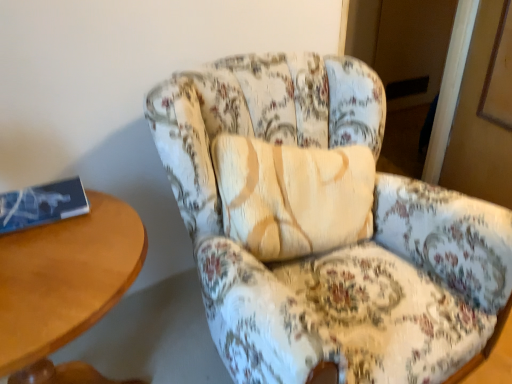
Where is `vacant region in front of blue paper book at left`? vacant region in front of blue paper book at left is located at coordinates (34, 255).